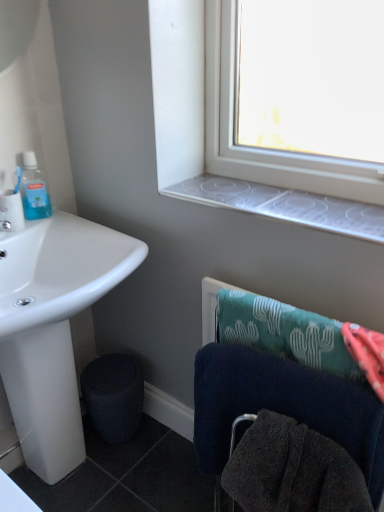
Where is `free location above clear plastic window sill at upper center (from a real-world perspective)`? free location above clear plastic window sill at upper center (from a real-world perspective) is located at coordinates (282, 202).